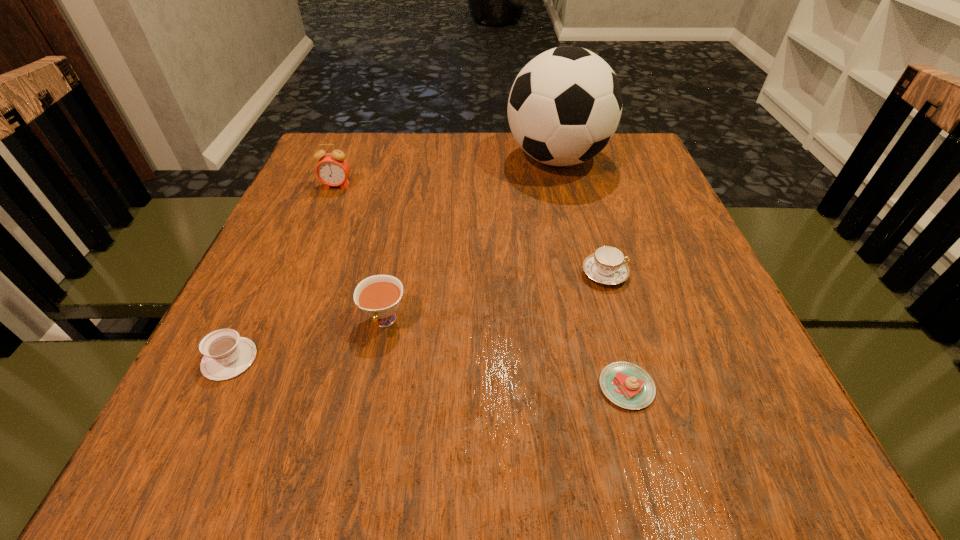
This screenshot has width=960, height=540. In order to click on vacant space that's between the soccer ball and the second teacup from left to right in this screenshot , I will do `click(470, 240)`.

Where is `blank region between the shortest object and the fourth nearest object`? The image size is (960, 540). blank region between the shortest object and the fourth nearest object is located at coordinates [x=615, y=330].

Where is `free space that is in between the leftmost teacup and the tallest object`? The width and height of the screenshot is (960, 540). free space that is in between the leftmost teacup and the tallest object is located at coordinates (394, 259).

The image size is (960, 540). I want to click on free point between the farthest teacup and the alarm clock, so click(470, 230).

This screenshot has width=960, height=540. I want to click on vacant space that's between the fifth shortest object and the tallest teacup, so click(x=361, y=254).

Select which object appears as the fourth closest to the second tallest object. Please provide its 2D coordinates. Your answer should be formatted as a tuple, i.e. [(x, y)], where the tuple contains the x and y coordinates of a point satisfying the conditions above.

[(607, 266)]

Find the location of a particular element. This screenshot has height=540, width=960. object identified as the closest to the fourth nearest object is located at coordinates (627, 385).

Where is `teacup object that ranks as the second closest to the leftmost teacup`? This screenshot has width=960, height=540. teacup object that ranks as the second closest to the leftmost teacup is located at coordinates pyautogui.click(x=607, y=266).

Where is `the third closest teacup relative to the soccer ball`? This screenshot has width=960, height=540. the third closest teacup relative to the soccer ball is located at coordinates coord(226,355).

Where is `vacant space that satisfies the following two spatial constraints: 1. on the side with the handle of the farthest teacup; 2. on the side of the third object from left to right with the handle`? vacant space that satisfies the following two spatial constraints: 1. on the side with the handle of the farthest teacup; 2. on the side of the third object from left to right with the handle is located at coordinates (618, 321).